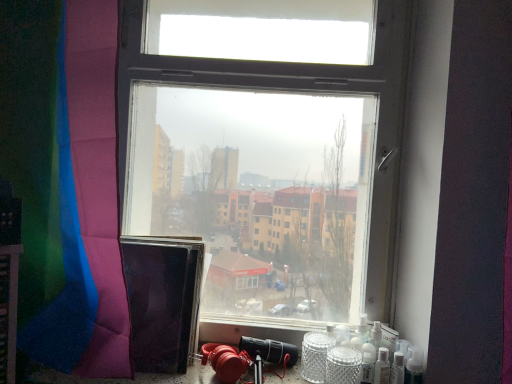
Question: From a real-world perspective, does silver textured glass jar at lower right, positioned as the 2th glass jar in left-to-right order, sit lower than shiny polyester curtain at left?

Choices:
 (A) yes
 (B) no

Answer: (A)

Question: Could you tell me if silver textured glass jar at lower right, which ranks as the 1th glass jar in right-to-left order, is facing shiny polyester curtain at left?

Choices:
 (A) yes
 (B) no

Answer: (B)

Question: From the image's perspective, is silver textured glass jar at lower right, positioned as the 2th glass jar in left-to-right order, below shiny polyester curtain at left?

Choices:
 (A) yes
 (B) no

Answer: (A)

Question: Considering the relative positions of silver textured glass jar at lower right, positioned as the 2th glass jar in left-to-right order, and shiny polyester curtain at left in the image provided, is silver textured glass jar at lower right, positioned as the 2th glass jar in left-to-right order, to the left of shiny polyester curtain at left from the viewer's perspective?

Choices:
 (A) no
 (B) yes

Answer: (A)

Question: Can you confirm if silver textured glass jar at lower right, positioned as the 2th glass jar in left-to-right order, is shorter than shiny polyester curtain at left?

Choices:
 (A) yes
 (B) no

Answer: (A)

Question: Can you confirm if silver textured glass jar at lower right, positioned as the 2th glass jar in left-to-right order, is smaller than shiny polyester curtain at left?

Choices:
 (A) yes
 (B) no

Answer: (A)

Question: Does silver textured glass jar at lower right, positioned as the 2th glass jar in left-to-right order, have a lesser width compared to clear glass jar at lower right, the second glass jar in the right-to-left sequence?

Choices:
 (A) yes
 (B) no

Answer: (B)

Question: Could you tell me if silver textured glass jar at lower right, positioned as the 2th glass jar in left-to-right order, is turned towards clear glass jar at lower right, the second glass jar in the right-to-left sequence?

Choices:
 (A) yes
 (B) no

Answer: (B)

Question: Does silver textured glass jar at lower right, which ranks as the 1th glass jar in right-to-left order, have a larger size compared to clear glass jar at lower right, the second glass jar in the right-to-left sequence?

Choices:
 (A) yes
 (B) no

Answer: (B)

Question: Would you say clear glass jar at lower right, the second glass jar in the right-to-left sequence, is part of silver textured glass jar at lower right, which ranks as the 1th glass jar in right-to-left order,'s contents?

Choices:
 (A) no
 (B) yes

Answer: (A)

Question: Is silver textured glass jar at lower right, which ranks as the 1th glass jar in right-to-left order, at the left side of clear glass jar at lower right, the first glass jar when ordered from left to right?

Choices:
 (A) no
 (B) yes

Answer: (A)

Question: Is silver textured glass jar at lower right, which ranks as the 1th glass jar in right-to-left order, smaller than clear glass jar at lower right, the second glass jar in the right-to-left sequence?

Choices:
 (A) yes
 (B) no

Answer: (A)

Question: Is clear glass jar at lower right, the second glass jar in the right-to-left sequence, bigger than silver textured glass jar at lower right, which ranks as the 1th glass jar in right-to-left order?

Choices:
 (A) no
 (B) yes

Answer: (B)